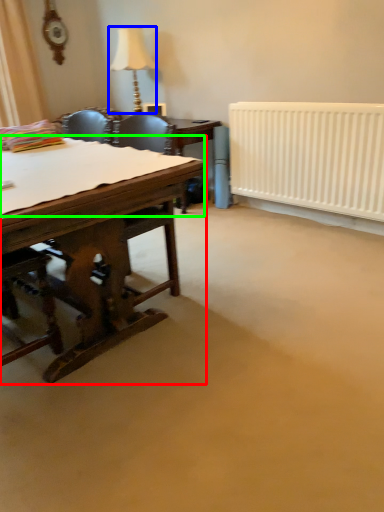
Question: Considering the real-world distances, which object is closest to desk (highlighted by a red box)? lamp (highlighted by a blue box) or sheet (highlighted by a green box).

Choices:
 (A) lamp
 (B) sheet

Answer: (B)